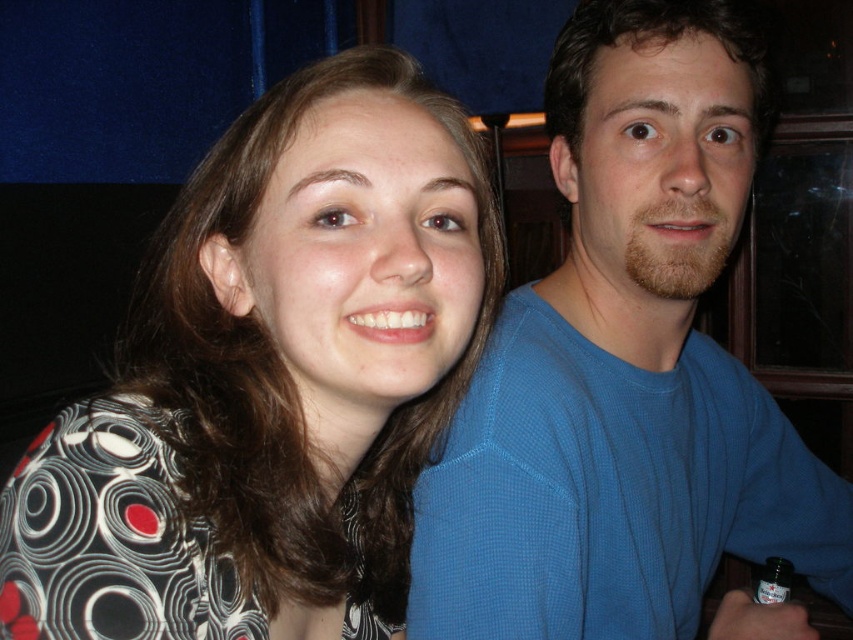
Question: Which point is closer to the camera?

Choices:
 (A) patterned fabric shirt at center
 (B) blue textured shirt at upper right

Answer: (A)

Question: Observing the image, what is the correct spatial positioning of patterned fabric shirt at center in reference to blue textured shirt at upper right?

Choices:
 (A) below
 (B) above

Answer: (B)

Question: Does patterned fabric shirt at center have a lesser width compared to blue textured shirt at upper right?

Choices:
 (A) yes
 (B) no

Answer: (A)

Question: Which point is farther to the camera?

Choices:
 (A) (675, 595)
 (B) (25, 536)

Answer: (A)

Question: Can you confirm if patterned fabric shirt at center is positioned below blue textured shirt at upper right?

Choices:
 (A) yes
 (B) no

Answer: (B)

Question: Which object appears closest to the camera in this image?

Choices:
 (A) patterned fabric shirt at center
 (B) blue textured shirt at upper right

Answer: (A)